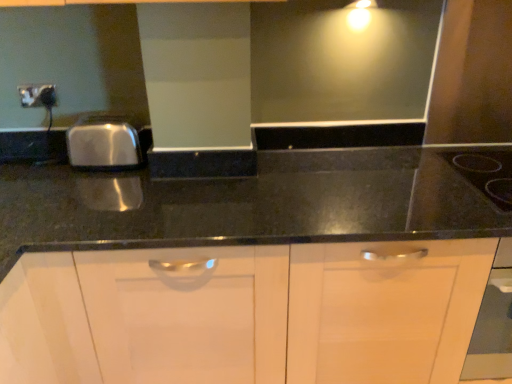
Question: From the image's perspective, would you say matte black outlet at upper left is shown under black glass gas stove at upper right?

Choices:
 (A) yes
 (B) no

Answer: (B)

Question: From a real-world perspective, is matte black outlet at upper left positioned under black glass gas stove at upper right based on gravity?

Choices:
 (A) no
 (B) yes

Answer: (A)

Question: Does matte black outlet at upper left have a smaller size compared to black glass gas stove at upper right?

Choices:
 (A) yes
 (B) no

Answer: (A)

Question: Is matte black outlet at upper left wider than black glass gas stove at upper right?

Choices:
 (A) yes
 (B) no

Answer: (B)

Question: Is matte black outlet at upper left to the right of black glass gas stove at upper right from the viewer's perspective?

Choices:
 (A) no
 (B) yes

Answer: (A)

Question: Can you confirm if matte black outlet at upper left is bigger than black glass gas stove at upper right?

Choices:
 (A) no
 (B) yes

Answer: (A)

Question: Is black glass gas stove at upper right next to matte black outlet at upper left and touching it?

Choices:
 (A) no
 (B) yes

Answer: (A)

Question: Does black glass gas stove at upper right have a larger size compared to matte black outlet at upper left?

Choices:
 (A) yes
 (B) no

Answer: (A)

Question: From the image's perspective, is black glass gas stove at upper right located beneath matte black outlet at upper left?

Choices:
 (A) no
 (B) yes

Answer: (B)

Question: Can you confirm if black glass gas stove at upper right is shorter than matte black outlet at upper left?

Choices:
 (A) no
 (B) yes

Answer: (B)

Question: Can you confirm if black glass gas stove at upper right is positioned to the right of matte black outlet at upper left?

Choices:
 (A) no
 (B) yes

Answer: (B)

Question: From a real-world perspective, is black glass gas stove at upper right physically below matte black outlet at upper left?

Choices:
 (A) no
 (B) yes

Answer: (B)

Question: Is black glass gas stove at upper right in front of or behind matte black outlet at upper left in the image?

Choices:
 (A) behind
 (B) front

Answer: (B)